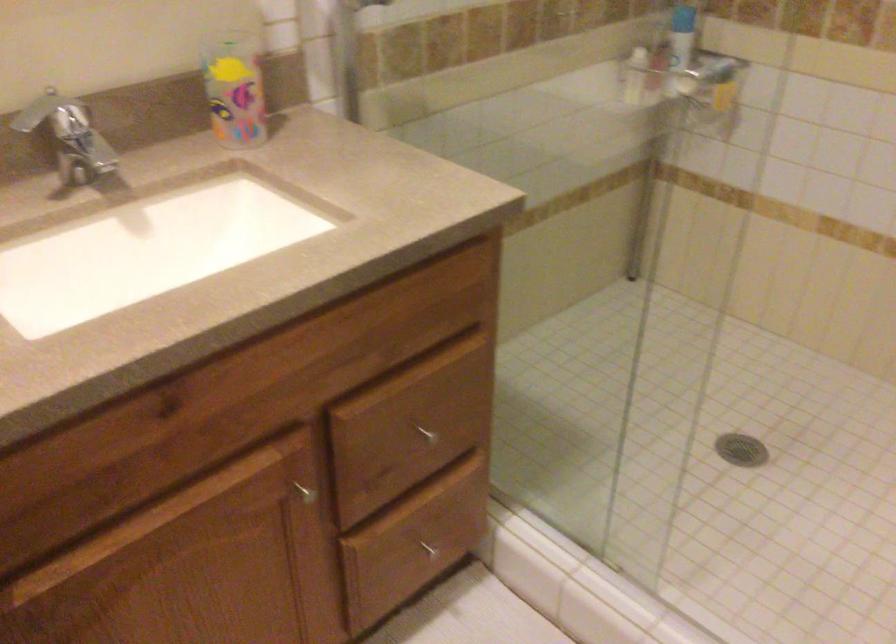
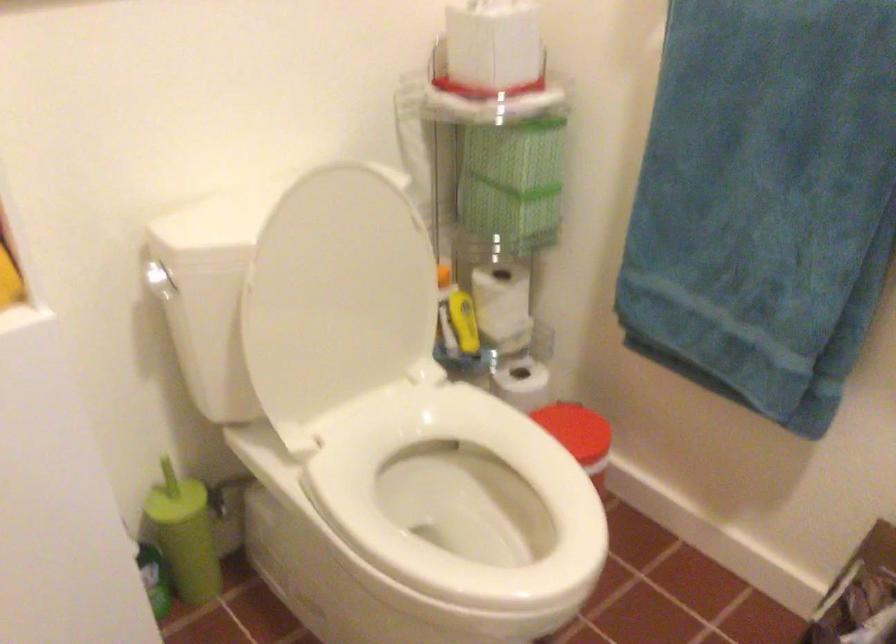
The images are taken continuously from a first-person perspective. In which direction is your viewpoint rotating?

The camera rotated toward left-down.